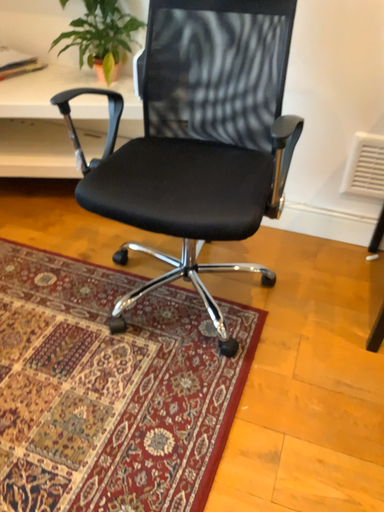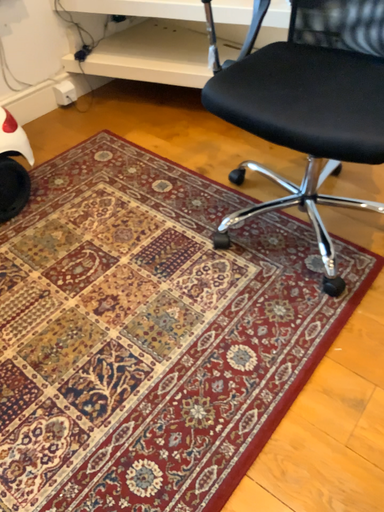
Question: How did the camera likely rotate when shooting the video?

Choices:
 (A) rotated downward
 (B) rotated upward

Answer: (A)